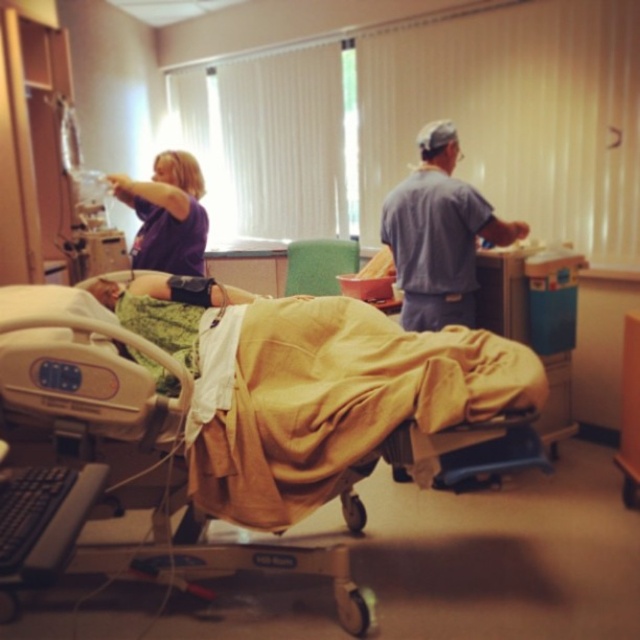
Can you confirm if blue scrubs at center is positioned above purple matte shirt at upper left?

No.

Identify the location of blue scrubs at center. (440, 234).

The width and height of the screenshot is (640, 640). Describe the element at coordinates (440, 234) in the screenshot. I see `blue scrubs at center` at that location.

In order to click on blue scrubs at center in this screenshot , I will do (440, 234).

Between point (192, 356) and point (157, 260), which one is positioned in front?

Point (192, 356)

Can you confirm if yellow fabric bed at center is positioned to the right of purple matte shirt at upper left?

Yes, yellow fabric bed at center is to the right of purple matte shirt at upper left.

Does point (452, 364) come farther from viewer compared to point (204, 221)?

No, (452, 364) is closer to viewer.

Identify the location of yellow fabric bed at center. (241, 412).

Who is positioned more to the left, yellow fabric bed at center or blue scrubs at center?

From the viewer's perspective, yellow fabric bed at center appears more on the left side.

Between yellow fabric bed at center and blue scrubs at center, which one is positioned lower?

yellow fabric bed at center

From the picture: Who is more distant from viewer, (289, 520) or (428, 273)?

Positioned behind is point (428, 273).

Find the location of a particular element. This screenshot has width=640, height=640. yellow fabric bed at center is located at coordinates click(x=241, y=412).